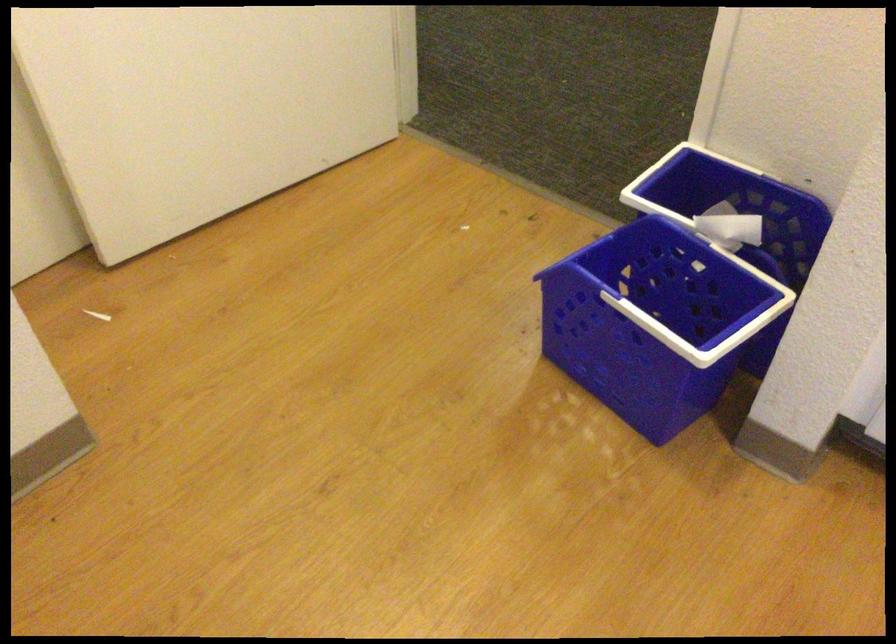
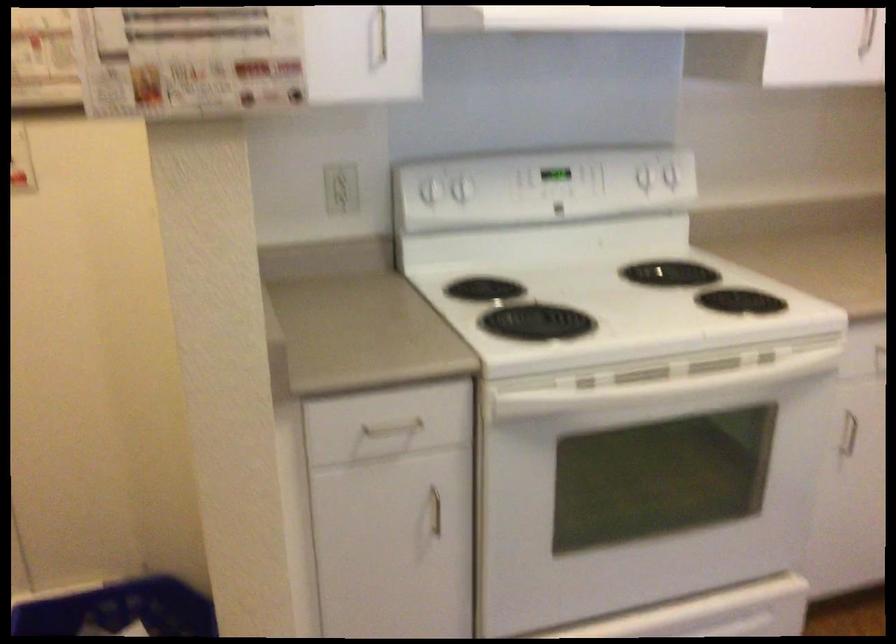
Question: How did the camera likely rotate?

Choices:
 (A) Left
 (B) Right
 (C) Up
 (D) Down

Answer: (B)